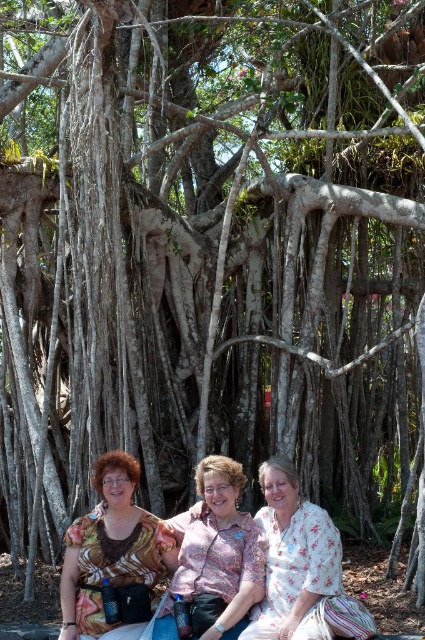
You are a photographer trying to capture a closeup of the pink floral blouse at center and the floral fabric blouse at center. Given that your camera can focus on objects within a 28 inch range, will you be able to capture both in the same shot?

The pink floral blouse at center and the floral fabric blouse at center are 29.04 inches apart, which is slightly beyond the camera focus range of 28 inches. Therefore, you might not be able to capture both in the same focused shot.

Consider the image. You are a photographer trying to capture a group photo of the printed fabric blouse at lower left and the floral fabric blouse at center. Which blouse should you focus on first if you want to start from the left side?

The printed fabric blouse at lower left should be focused on first since it is positioned on the left side of the floral fabric blouse at center.